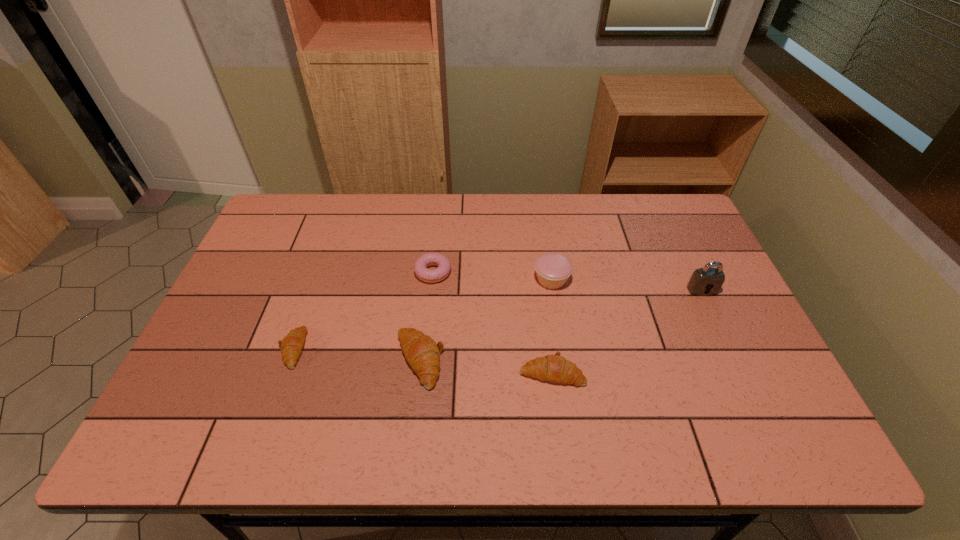
At what (x,y) coordinates should I click in order to perform the action: click on the leftmost object. Please return your answer as a coordinate pair (x, y). The image size is (960, 540). Looking at the image, I should click on (291, 346).

This screenshot has height=540, width=960. Find the location of `the shortest crescent roll`. the shortest crescent roll is located at coordinates (291, 346).

Identify the location of the second crescent roll from left to right. The height and width of the screenshot is (540, 960). coord(422,353).

Locate an element on the screen. Image resolution: width=960 pixels, height=540 pixels. the tallest crescent roll is located at coordinates (422, 353).

You are a GUI agent. You are given a task and a screenshot of the screen. Output one action in this format:
    pyautogui.click(x=<x>, y=<y>)
    Task: Click on the second shortest crescent roll
    The height and width of the screenshot is (540, 960).
    Given the screenshot: What is the action you would take?
    pyautogui.click(x=555, y=368)

At what (x,y) coordinates should I click in order to perform the action: click on cupcake. Please return your answer as a coordinate pair (x, y). Looking at the image, I should click on (553, 269).

Identify the location of the tallest object. The height and width of the screenshot is (540, 960). (702, 280).

The width and height of the screenshot is (960, 540). What are the coordinates of `padlock` in the screenshot? It's located at (702, 280).

The width and height of the screenshot is (960, 540). Find the location of `doughnut`. doughnut is located at coordinates (442, 271).

Locate an element on the screen. vacant space located on the back of the shortest crescent roll is located at coordinates (312, 292).